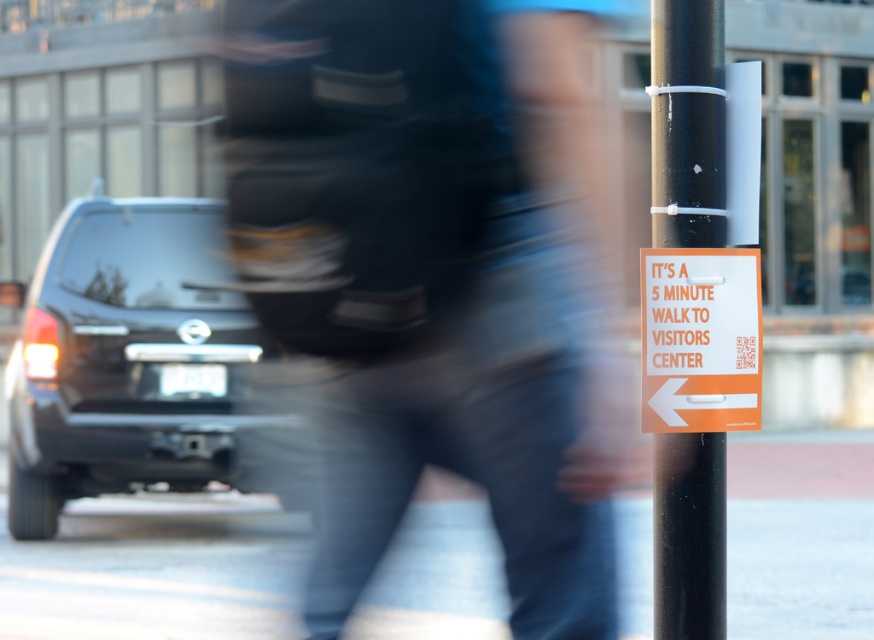
Find the location of a particular element. black matte suv at left is located at coordinates (128, 358).

Who is shorter, black matte suv at left or orange matte sign at center?

orange matte sign at center is shorter.

Locate an element on the screen. This screenshot has height=640, width=874. black matte suv at left is located at coordinates (128, 358).

In the scene shown: Can you confirm if smooth concrete pavement at center is positioned to the left of black metal pole at center?

Indeed, smooth concrete pavement at center is positioned on the left side of black metal pole at center.

Which is more to the right, smooth concrete pavement at center or black metal pole at center?

Positioned to the right is black metal pole at center.

Who is more distant from viewer, (x=172, y=593) or (x=670, y=42)?

The point (x=172, y=593) is more distant.

This screenshot has height=640, width=874. What are the coordinates of `smooth concrete pavement at center` in the screenshot? It's located at (155, 572).

Does black metal pole at center have a smaller size compared to orange matte sign at center?

Yes.

Does black metal pole at center have a greater width compared to orange matte sign at center?

No, black metal pole at center is not wider than orange matte sign at center.

I want to click on black metal pole at center, so click(x=689, y=536).